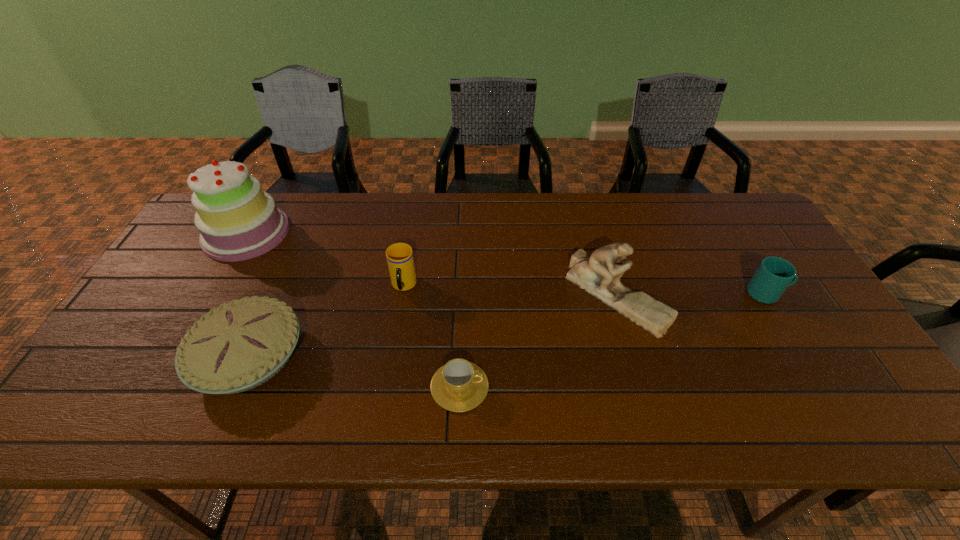
Locate an element on the screen. Image resolution: width=960 pixels, height=540 pixels. blank area in the image that satisfies the following two spatial constraints: 1. on the handle side of the rightmost object; 2. on the front-facing side of the fifth object from left to right is located at coordinates (768, 295).